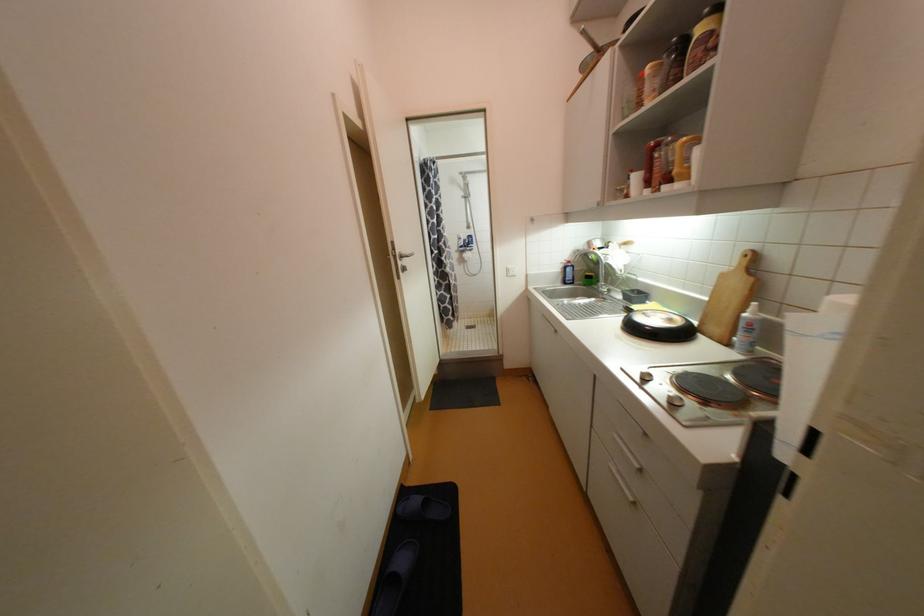
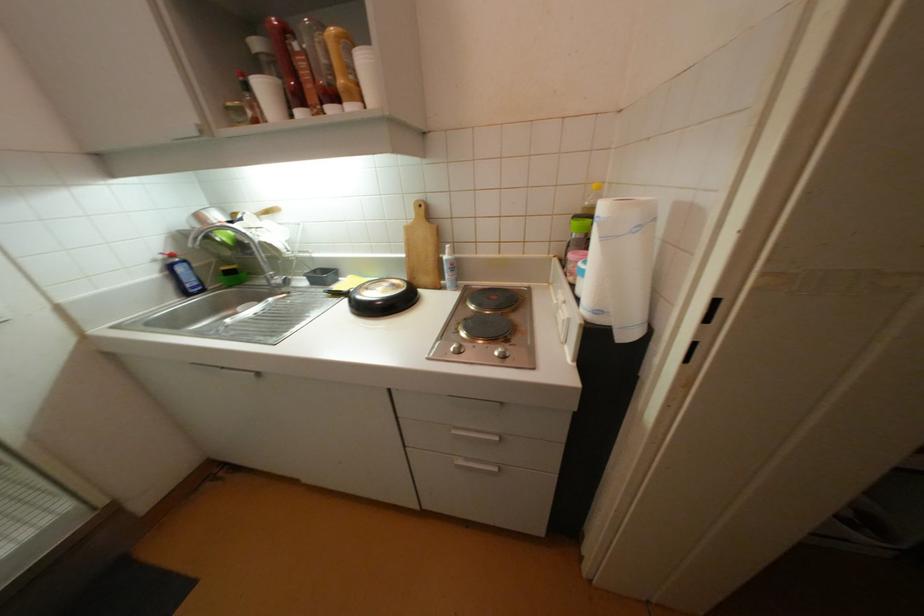
How did the camera likely rotate?

The rotation direction of the camera is right-down.